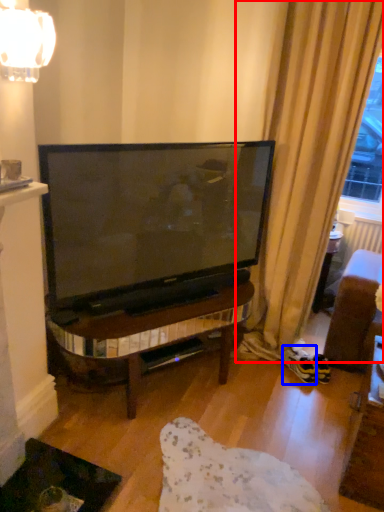
Question: Among these objects, which one is nearest to the camera, curtain (highlighted by a red box) or footwear (highlighted by a blue box)?

Choices:
 (A) curtain
 (B) footwear

Answer: (A)